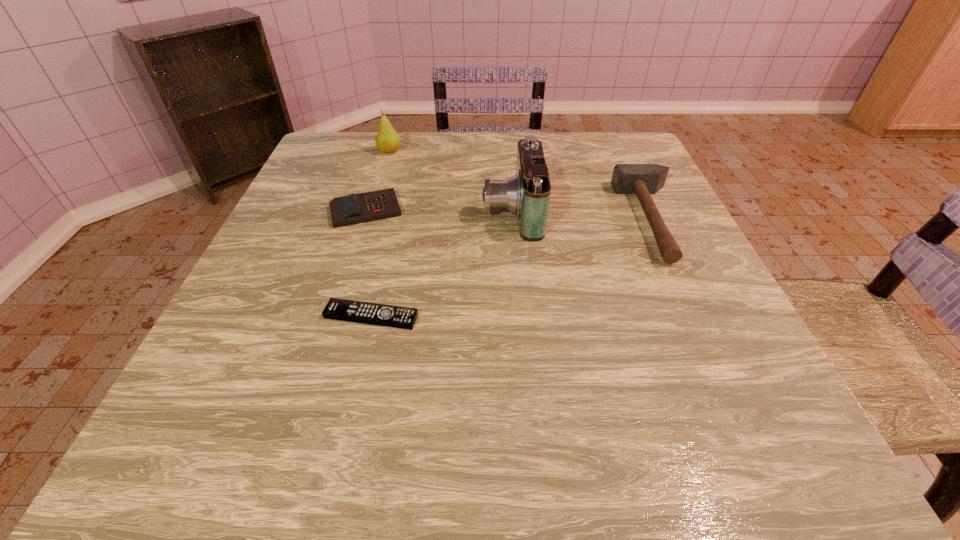
Locate an element on the screen. vacant space situated on the left of the pear is located at coordinates (351, 152).

Where is `vacant space positioned 0.220m on the striking surface of the hammer`? The width and height of the screenshot is (960, 540). vacant space positioned 0.220m on the striking surface of the hammer is located at coordinates (523, 220).

Identify the location of vacant region located 0.320m on the striking surface of the hammer. (477, 220).

This screenshot has width=960, height=540. What are the coordinates of `vacant region located on the striking surface of the hammer` in the screenshot? It's located at (454, 220).

Locate an element on the screen. The width and height of the screenshot is (960, 540). vacant space located on the front of the fourth tallest object is located at coordinates (351, 257).

Where is `free space located on the front of the shortest object`? This screenshot has height=540, width=960. free space located on the front of the shortest object is located at coordinates (353, 393).

The width and height of the screenshot is (960, 540). What are the coordinates of `object present at the far edge` in the screenshot? It's located at (387, 140).

Image resolution: width=960 pixels, height=540 pixels. I want to click on object positioned at the left edge, so click(x=353, y=209).

What are the coordinates of `object positioned at the right edge` in the screenshot? It's located at (641, 179).

I want to click on vacant point at the far edge, so click(509, 174).